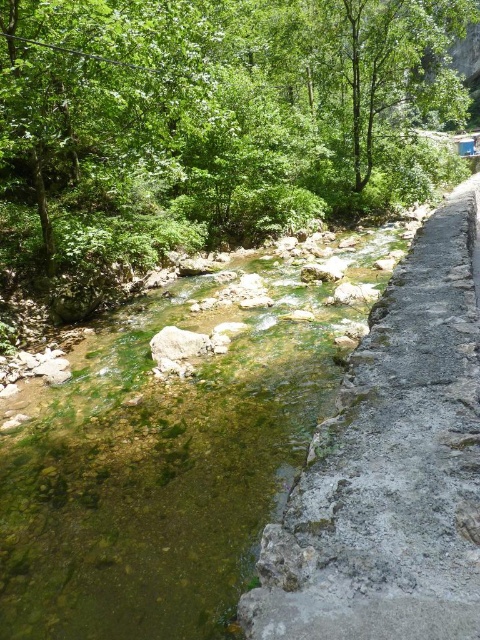
You are a hiker who wants to cross the stream shown in the image. You see the clear water at center and the gray stone path at right. Which object is located to the left of the other?

The clear water at center is positioned on the left side of gray stone path at right, so the clear water at center is to the left of the gray stone path at right.

You are a hiker carrying a heavy backpack and need to cross the clear water at center to reach the gray stone path at right. The stream is 6.63 meters wide. If your backpack weighs 15 kg, can you safely cross the stream without overexerting yourself?

The clear water at center and gray stone path at right are 6.63 meters apart. Since the stream is 6.63 meters wide, you can cross it safely as long as you choose a path with stable footing and avoid areas with slippery algae or rocks. The backpack weight alone doesn